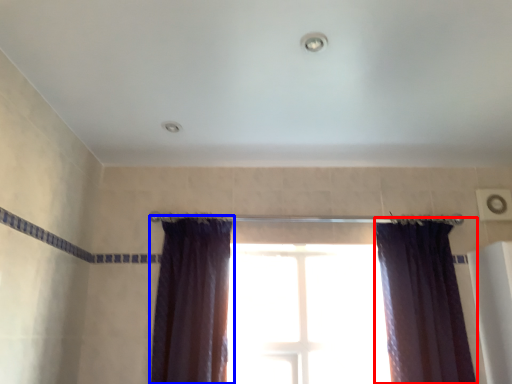
Question: Which point is further to the camera, curtain (highlighted by a red box) or curtain (highlighted by a blue box)?

Choices:
 (A) curtain
 (B) curtain

Answer: (A)